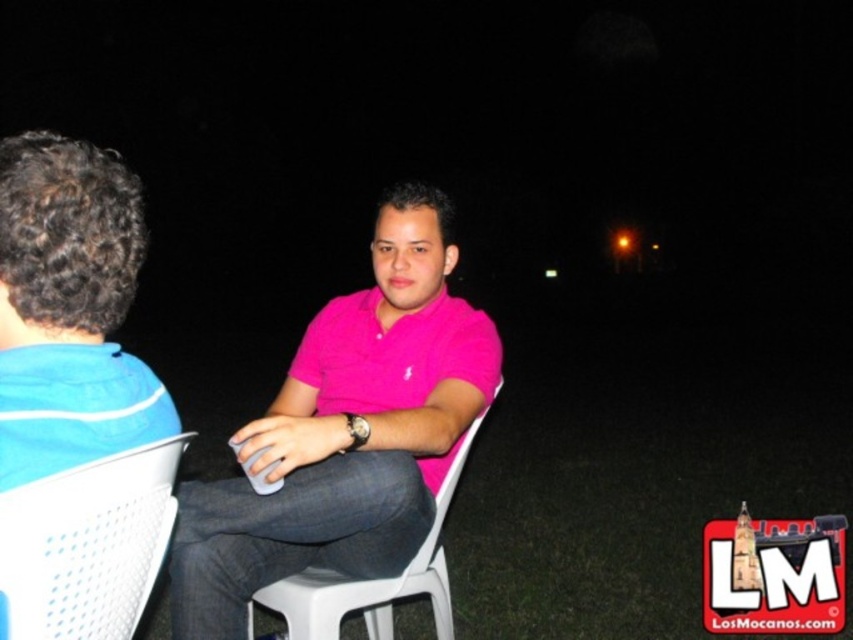
You are standing in the nighttime scene and want to locate the pink matte shirt at center. According to the coordinates given, where would you look to find it?

The pink matte shirt at center is located at coordinates point 0.677 on the x axis and 0.406 on the y axis.

You are standing in the nighttime scene and see the point at coordinates (345, 433). Which object from the scene is this point located on?

The point at coordinates (345, 433) is located on the pink matte shirt at center.